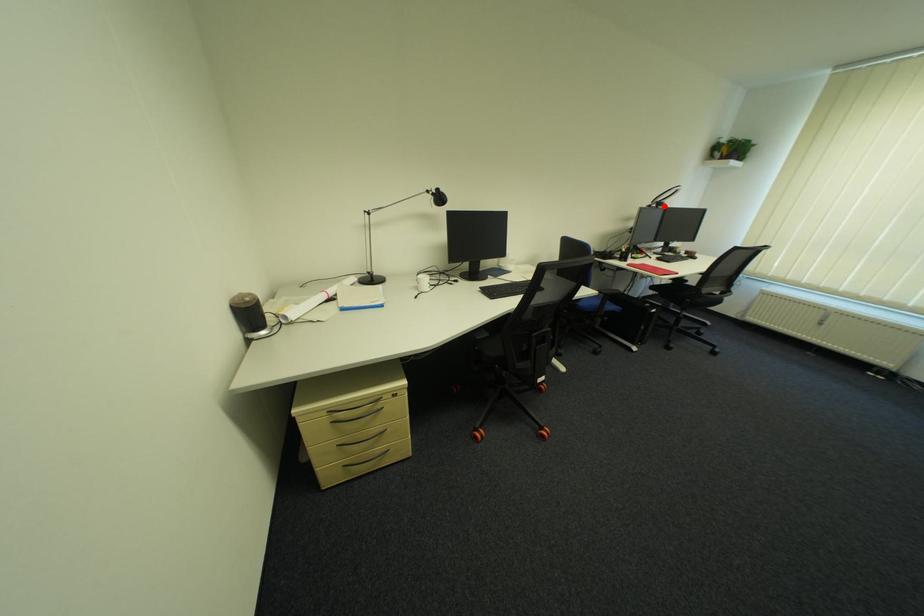
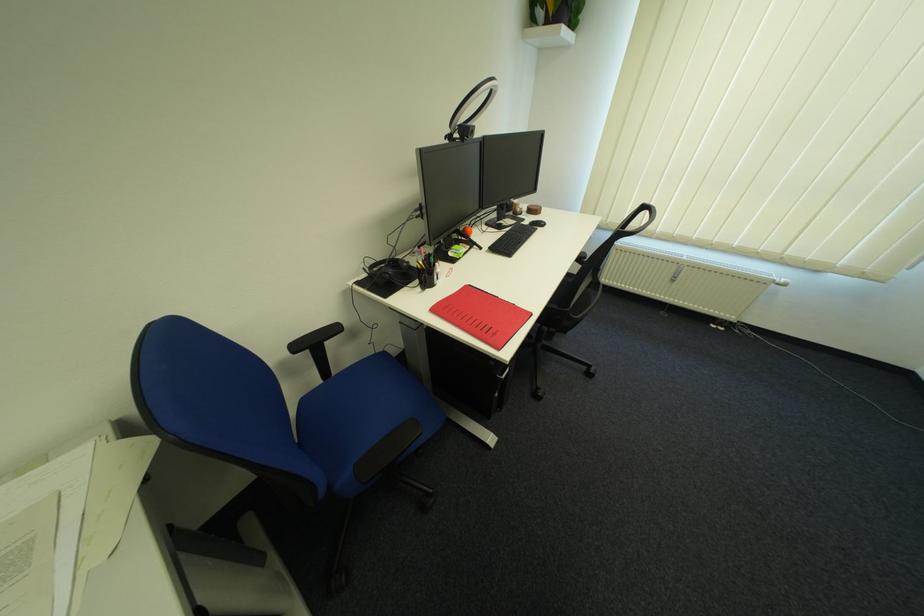
Question: I am providing you with two images of the same scene from different viewpoints. A red point is shown in image1. For the corresponding object point in image2, is it positioned nearer or farther from the camera?

Choices:
 (A) Nearer
 (B) Farther

Answer: (B)